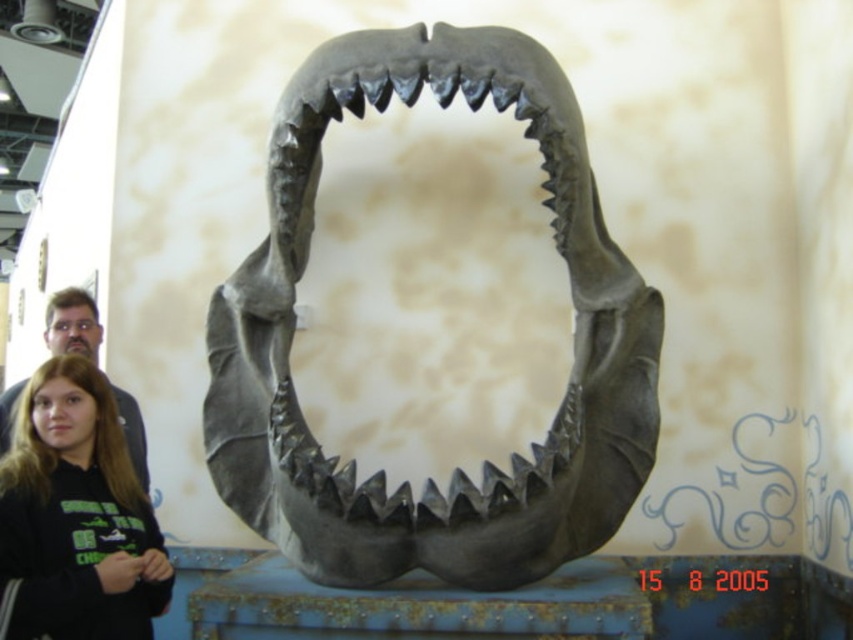
You are trying to determine the relative sizes of the objects in the scene. Which object is narrower between the black hoodie at lower left and the matte black hair at lower left?

The black hoodie at lower left has a lesser width compared to the matte black hair at lower left, so the black hoodie at lower left is narrower.

You are standing in front of the gray metallic shark jaw at center and the black hoodie at lower left. Which object is positioned to the right side?

The gray metallic shark jaw at center is positioned to the right of the black hoodie at lower left.